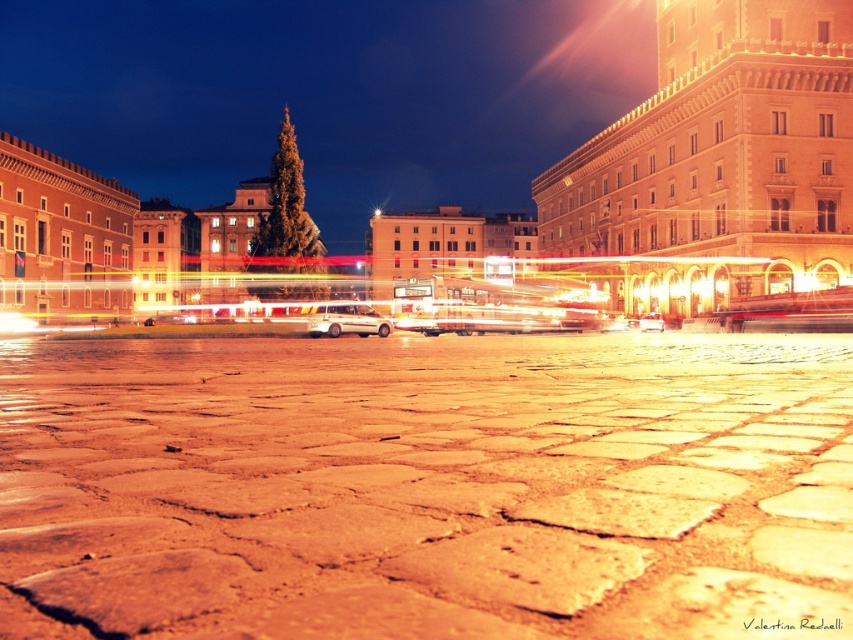
Question: Which of these objects is positioned farthest from the metallic silver car at center?

Choices:
 (A) brown stone square at center
 (B) smooth stone pavement at center
 (C) white matte van at center

Answer: (A)

Question: In this image, where is smooth stone pavement at center located relative to white matte van at center?

Choices:
 (A) below
 (B) above

Answer: (A)

Question: Which of these objects is positioned closest to the smooth stone square at center?

Choices:
 (A) metallic silver car at center
 (B) brown stone square at center
 (C) smooth stone pavement at center

Answer: (B)

Question: Does smooth stone square at center appear over white matte van at center?

Choices:
 (A) yes
 (B) no

Answer: (B)

Question: Can you confirm if brown stone square at center is positioned above white matte van at center?

Choices:
 (A) yes
 (B) no

Answer: (B)

Question: Considering the real-world distances, which object is closest to the brown stone square at center?

Choices:
 (A) smooth stone pavement at center
 (B) smooth stone square at center
 (C) white matte van at center

Answer: (B)